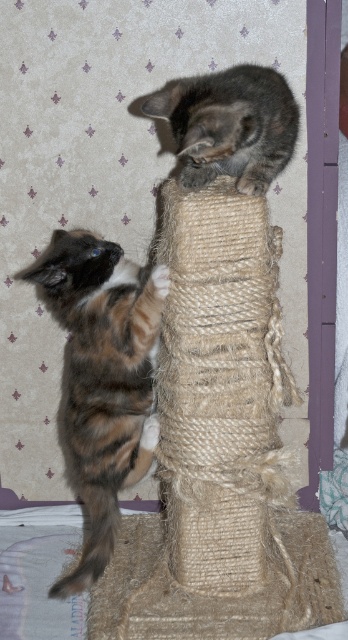
Is calico fur cat at left below gray textured cat at upper center?

Yes.

Between point (85, 352) and point (188, 77), which one is positioned in front?

Positioned in front is point (85, 352).

Where is `calico fur cat at left`? Image resolution: width=348 pixels, height=640 pixels. calico fur cat at left is located at coordinates [104, 376].